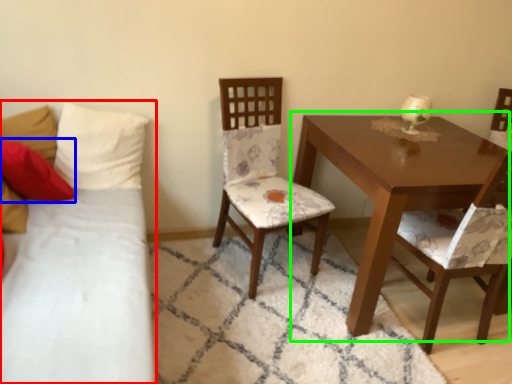
Question: Which is farther away from studio couch (highlighted by a red box)? pillow (highlighted by a blue box) or table (highlighted by a green box)?

Choices:
 (A) pillow
 (B) table

Answer: (B)